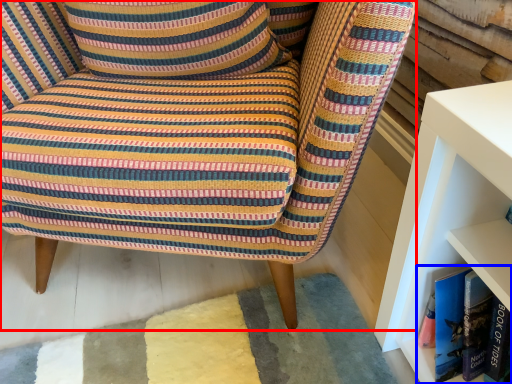
Question: Which object is further to the camera taking this photo, chair (highlighted by a red box) or book (highlighted by a blue box)?

Choices:
 (A) chair
 (B) book

Answer: (B)